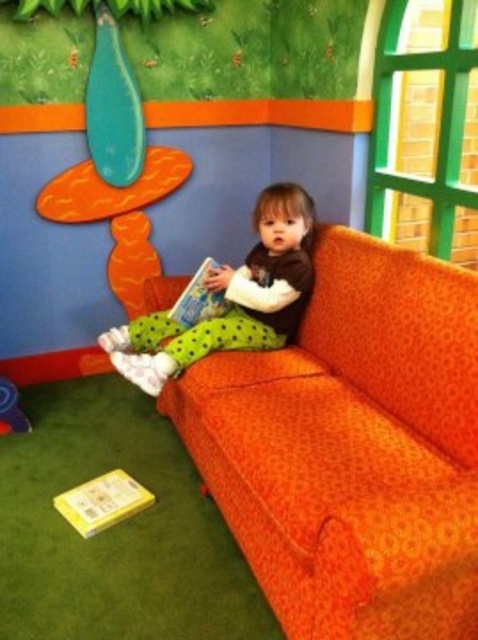
You are a toy robot that needs to place a new toy between the matte green pants at center and the hardcover book at center. The toy is 8 inches long. Can you fit it between them without moving either object?

The distance between the matte green pants at center and the hardcover book at center is 7.14 inches. Since the toy is 8 inches long, which is longer than the available space, it cannot be placed between them without moving either object.

You are a parent trying to tidy up the living room. You need to place a new toy box that is 30 cm tall. The orange fabric couch at center is currently in front of the yellow matte book at lower left. Where should you position the toy box so it doesn

Since the orange fabric couch at center is in front of the yellow matte book at lower left, you should place the toy box behind the orange fabric couch at center to avoid blocking the yellow matte book at lower left.

Based on the photo, you are standing in the room and want to sit down on the orange fabric couch at center. Based on its 2D coordinates, where should you move to reach it?

The orange fabric couch at center is located at 2D coordinates point (351, 449), so you should move towards that point to reach it.